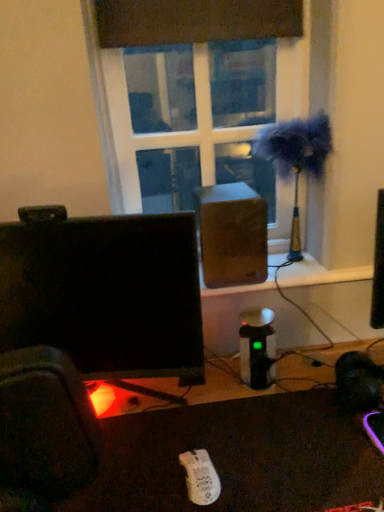
Locate an element on the screen. This screenshot has width=384, height=512. vacant space positioned to the left of white matte wii controller at lower center is located at coordinates (138, 474).